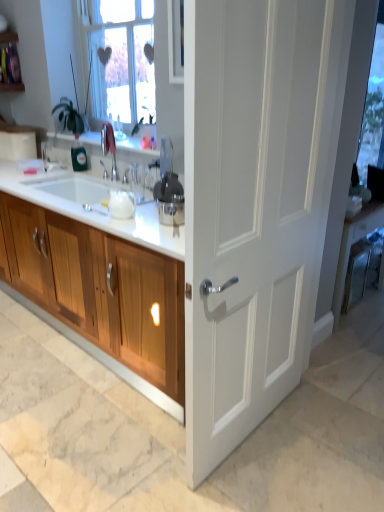
Measure the distance between white matte door at center and camera.

They are 3.49 feet apart.

This screenshot has height=512, width=384. I want to click on white glossy countertop at center, so click(x=92, y=206).

Locate an element on the screen. This screenshot has width=384, height=512. satin silver juicer at center is located at coordinates (169, 199).

Describe the element at coordinates (373, 112) in the screenshot. I see `transparent glass window screen at upper right` at that location.

This screenshot has height=512, width=384. I want to click on wooden cabinet at left, so click(99, 289).

Based on the photo, looking at their sizes, would you say transparent glass window screen at upper right is wider or thinner than white matte door at center?

In the image, transparent glass window screen at upper right appears to be more narrow than white matte door at center.

How far apart are transparent glass window screen at upper right and white matte door at center?

transparent glass window screen at upper right and white matte door at center are 98.61 centimeters apart.

How different are the orientations of transparent glass window screen at upper right and white matte door at center in degrees?

They differ by 3.39 degrees in their facing directions.

Who is taller, transparent glass window screen at upper right or white matte door at center?

With more height is white matte door at center.

Is white matte door at center touching satin silver juicer at center?

No.

From the image's perspective, who appears lower, white matte door at center or satin silver juicer at center?

white matte door at center is shown below in the image.

Is white matte door at center not within satin silver juicer at center?

Absolutely, white matte door at center is external to satin silver juicer at center.

Is white matte door at center aimed at satin silver juicer at center?

Yes, white matte door at center faces towards satin silver juicer at center.

Which of these two, wooden cabinet at left or satin silver juicer at center, is thinner?

With smaller width is satin silver juicer at center.

Is wooden cabinet at left smaller than satin silver juicer at center?

No.

Considering their positions, is wooden cabinet at left located in front of or behind satin silver juicer at center?

In the image, wooden cabinet at left appears in front of satin silver juicer at center.

From the image's perspective, is wooden cabinet at left located above or below satin silver juicer at center?

wooden cabinet at left is situated lower than satin silver juicer at center in the image.

Considering the relative sizes of satin silver juicer at center and transparent glass window screen at upper right in the image provided, is satin silver juicer at center thinner than transparent glass window screen at upper right?

In fact, satin silver juicer at center might be wider than transparent glass window screen at upper right.

Where is `appliance below the transparent glass window screen at upper right (from a real-world perspective)`? This screenshot has height=512, width=384. appliance below the transparent glass window screen at upper right (from a real-world perspective) is located at coordinates (169, 199).

Between satin silver juicer at center and transparent glass window screen at upper right, which one appears on the left side from the viewer's perspective?

From the viewer's perspective, satin silver juicer at center appears more on the left side.

Based on the photo, considering the sizes of objects wooden cabinet at left and white matte door at center in the image provided, who is wider, wooden cabinet at left or white matte door at center?

Wider between the two is wooden cabinet at left.

Which of these two, wooden cabinet at left or white matte door at center, stands taller?

With more height is white matte door at center.

Would you say wooden cabinet at left is outside white matte door at center?

wooden cabinet at left lies outside white matte door at center's area.

Locate an element on the screen. The image size is (384, 512). door positioned vertically above the wooden cabinet at left (from a real-world perspective) is located at coordinates (254, 204).

Considering the positions of objects white matte door at center and wooden cabinet at left in the image provided, who is more to the right, white matte door at center or wooden cabinet at left?

white matte door at center.

Between white matte door at center and wooden cabinet at left, which one is positioned in front?

white matte door at center is in front.

You are a GUI agent. You are given a task and a screenshot of the screen. Output one action in this format:
    pyautogui.click(x=<x>, y=<y>)
    Task: Click on the door that appears in front of the wooden cabinet at left
    
    Given the screenshot: What is the action you would take?
    pyautogui.click(x=254, y=204)

Can white glossy countertop at center be found inside white matte door at center?

No, white matte door at center does not contain white glossy countertop at center.

Image resolution: width=384 pixels, height=512 pixels. There is a white matte door at center. Identify the location of countertop above it (from a real-world perspective). (92, 206).

Does point (266, 338) lie behind point (63, 179)?

No, (266, 338) is in front of (63, 179).

Looking at their sizes, would you say white matte door at center is wider or thinner than white glossy countertop at center?

white matte door at center is thinner than white glossy countertop at center.

Find the location of a particular element. Image resolution: width=384 pixels, height=512 pixels. door located on the left of transparent glass window screen at upper right is located at coordinates (254, 204).

Find the location of a particular element. appliance behind the white matte door at center is located at coordinates (169, 199).

Which object lies nearer to the anchor point satin silver juicer at center, wooden cabinet at left or white matte door at center?

wooden cabinet at left lies closer to satin silver juicer at center than the other object.

Which object lies further to the anchor point wooden cabinet at left, transparent glass window screen at upper right or white glossy countertop at center?

transparent glass window screen at upper right is positioned further to the anchor wooden cabinet at left.

Estimate the real-world distances between objects in this image. Which object is closer to white glossy countertop at center, transparent glass window screen at upper right or satin silver juicer at center?

satin silver juicer at center lies closer to white glossy countertop at center than the other object.

Looking at the image, which one is located further to wooden cabinet at left, satin silver juicer at center or white glossy countertop at center?

Among the two, satin silver juicer at center is located further to wooden cabinet at left.

Which object lies nearer to the anchor point white glossy countertop at center, wooden cabinet at left or satin silver juicer at center?

Based on the image, wooden cabinet at left appears to be nearer to white glossy countertop at center.

When comparing their distances from white glossy countertop at center, does satin silver juicer at center or wooden cabinet at left seem further?

The object further to white glossy countertop at center is satin silver juicer at center.

From the image, which object appears to be nearer to satin silver juicer at center, transparent glass window screen at upper right or white matte door at center?

white matte door at center is closer to satin silver juicer at center.

Looking at the image, which one is located further to satin silver juicer at center, wooden cabinet at left or transparent glass window screen at upper right?

transparent glass window screen at upper right is positioned further to the anchor satin silver juicer at center.

Locate an element on the screen. countertop between wooden cabinet at left and transparent glass window screen at upper right from left to right is located at coordinates (92, 206).

Where is `countertop between wooden cabinet at left and white matte door at center from left to right`? The width and height of the screenshot is (384, 512). countertop between wooden cabinet at left and white matte door at center from left to right is located at coordinates (92, 206).

Image resolution: width=384 pixels, height=512 pixels. Identify the location of appliance positioned between white matte door at center and transparent glass window screen at upper right from near to far. (169, 199).

Find the location of `cabinetry between white glossy countertop at center and satin silver juicer at center in the front-back direction`. cabinetry between white glossy countertop at center and satin silver juicer at center in the front-back direction is located at coordinates (99, 289).